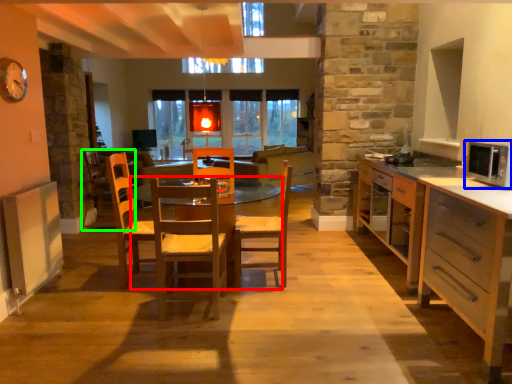
Question: Based on their relative distances, which object is nearer to table (highlighted by a red box)? Choose from microwave oven (highlighted by a blue box) and armchair (highlighted by a green box).

Choices:
 (A) microwave oven
 (B) armchair

Answer: (B)